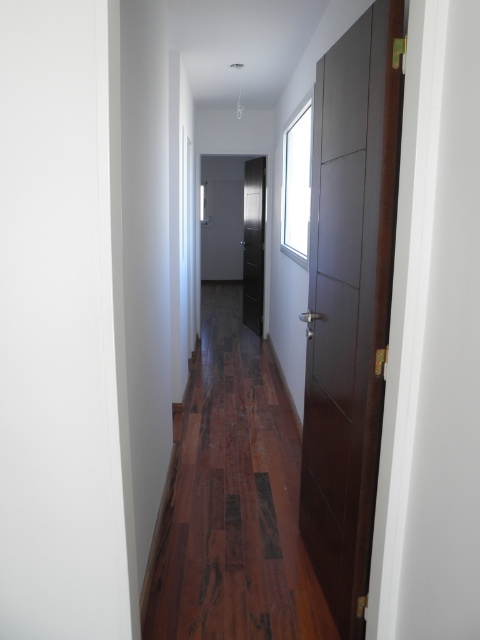
You are moving a 1.8 meter long wooden plank through the hallway. You need to place it between the dark wood floor at center and the brown wood flooring at center. Is there enough space for the plank to fit between them?

The dark wood floor at center and brown wood flooring at center are 1.50 meters apart. Since the plank is 1.8 meters long, it is longer than the available space. Therefore, the plank cannot fit between them.

You are standing in the hallway and want to place a small potted plant between the brown wood flooring at center and the dark wood door at center. Which object should the plant be closer to?

The brown wood flooring at center is located below the dark wood door at center, so the plant should be placed closer to the dark wood door at center to be between them.

You are standing in the hallway and see two points marked on the floor. The first point is at coordinates point (344, 320) and the second is at point (254, 260). Which point is closer to you as you face the direction of the hallway?

Point (344, 320) is in front of point (254, 260), so it is closer to you as you face the hallway direction.